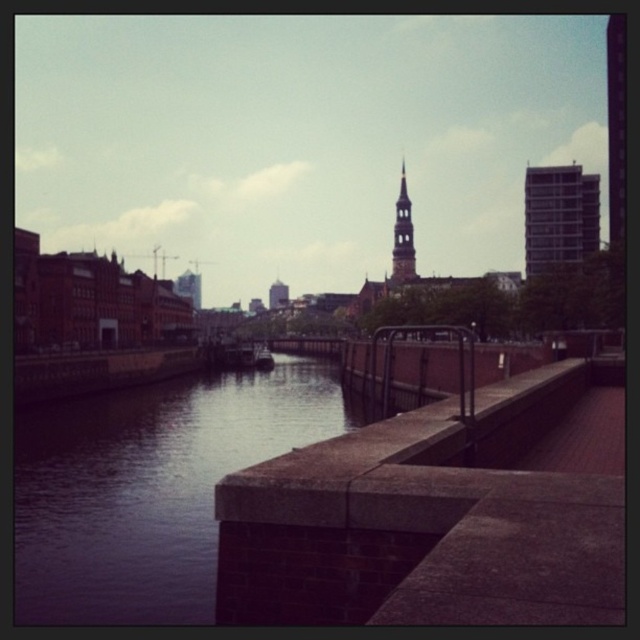
What are the coordinates of `dark gray concrete river at center` in the screenshot? It's located at (150, 486).

Does point (96, 422) lie in front of point (556, 260)?

Yes, point (96, 422) is closer to viewer.

You are a GUI agent. You are given a task and a screenshot of the screen. Output one action in this format:
    pyautogui.click(x=<x>, y=<y>)
    Task: Click on the dark gray concrete river at center
    This screenshot has width=640, height=640.
    Given the screenshot: What is the action you would take?
    pyautogui.click(x=150, y=486)